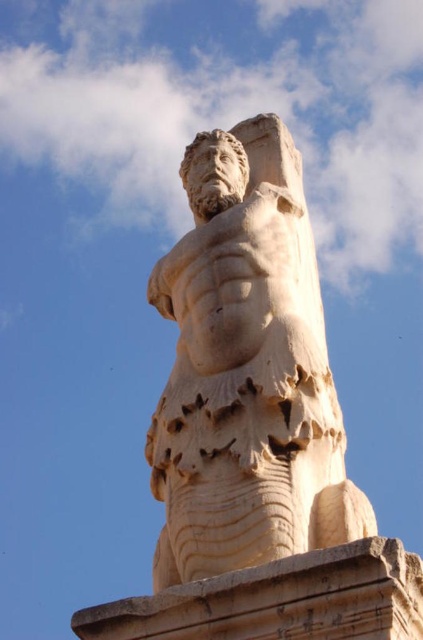
From the picture: You are a tour guide explaining the layout of an outdoor sculpture garden to visitors. You point out the white marble statue at center and the beige stone pillar at center. How far apart are these two landmarks?

The distance between the white marble statue at center and the beige stone pillar at center is 12.89 meters.

You are standing in front of the classical stone statue of a male figure. There is a point located at coordinates (x=247, y=371). Can you determine which object this point belongs to?

The point at coordinates (x=247, y=371) is on the white marble statue at center.

You are an art conservator assessing the placement of the white marble statue at center and the beige stone pillar at center in the courtyard. Given their sizes, which object would likely require a deeper foundation to support its weight and height?

The white marble statue at center is much taller than the beige stone pillar at center, so it would require a deeper foundation to support its height and weight.